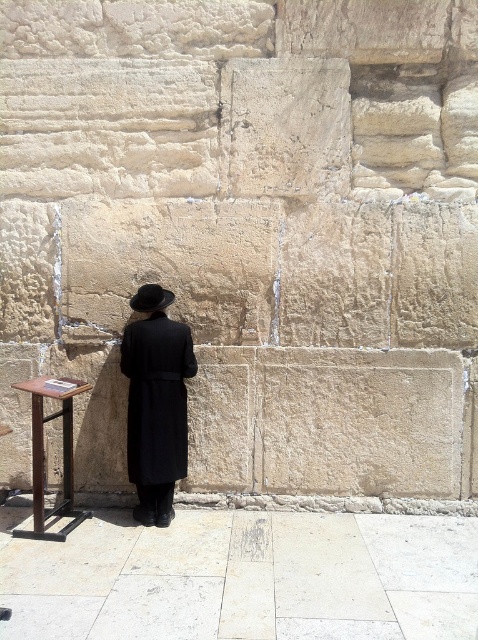
You are a tour guide leading a group near the historical stone wall. You need to place a 36 inch long banner between the brown wooden stool at lower left and the black felt fedora at center. Can the banner fit between them?

The distance between the brown wooden stool at lower left and the black felt fedora at center is 38.91 inches. Since the banner is 36 inches long, it can fit between them as there is enough space.

You are a photographer trying to capture the person in the scene. You notice the black matte coat at center and the black felt fedora at center. Which object should you focus on first if you want to capture the one that is lower in the image?

The black matte coat at center is located below the black felt fedora at center, so you should focus on the black matte coat at center first since it is lower in the image.

You are a tailor measuring garments for a client. You have a black matte coat at center and a brown wooden stool at lower left. Which item has a smaller width when viewed from the front?

The black matte coat at center is thinner than the brown wooden stool at lower left, so the black matte coat at center has a smaller width when viewed from the front.